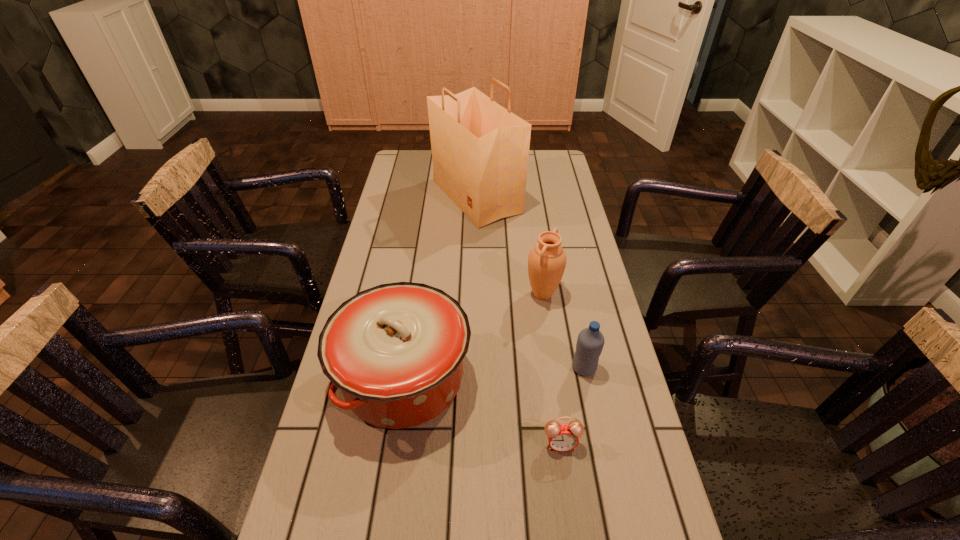
Where is `the farthest object`? the farthest object is located at coordinates (480, 150).

At what (x,y) coordinates should I click in order to perform the action: click on grocery bag. Please return your answer as a coordinate pair (x, y). Looking at the image, I should click on (480, 150).

The width and height of the screenshot is (960, 540). Identify the location of casserole. (396, 351).

The image size is (960, 540). I want to click on the second farthest object, so click(547, 260).

I want to click on the second shortest object, so click(590, 342).

At what (x,y) coordinates should I click in order to perform the action: click on the shortest object. Please return your answer as a coordinate pair (x, y). Looking at the image, I should click on (562, 437).

Locate an element on the screen. vacant space located on the side of the tallest object with the superhero design is located at coordinates (535, 197).

What are the coordinates of `vacant space located on the right of the casserole` in the screenshot? It's located at (512, 378).

This screenshot has height=540, width=960. I want to click on vacant space located 0.060m on the back of the urn, so click(x=539, y=268).

Image resolution: width=960 pixels, height=540 pixels. Identify the location of vacant space situated 0.230m on the back of the water bottle. (568, 295).